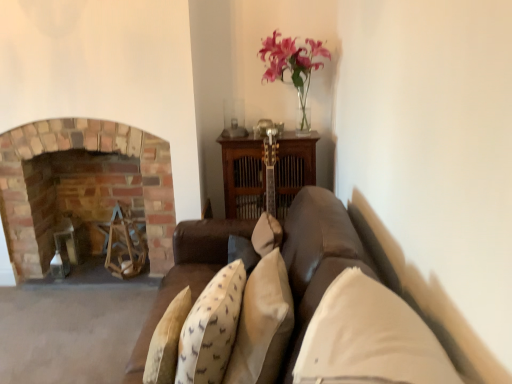
I want to click on unoccupied area in front of brick fireplace at left, so click(74, 319).